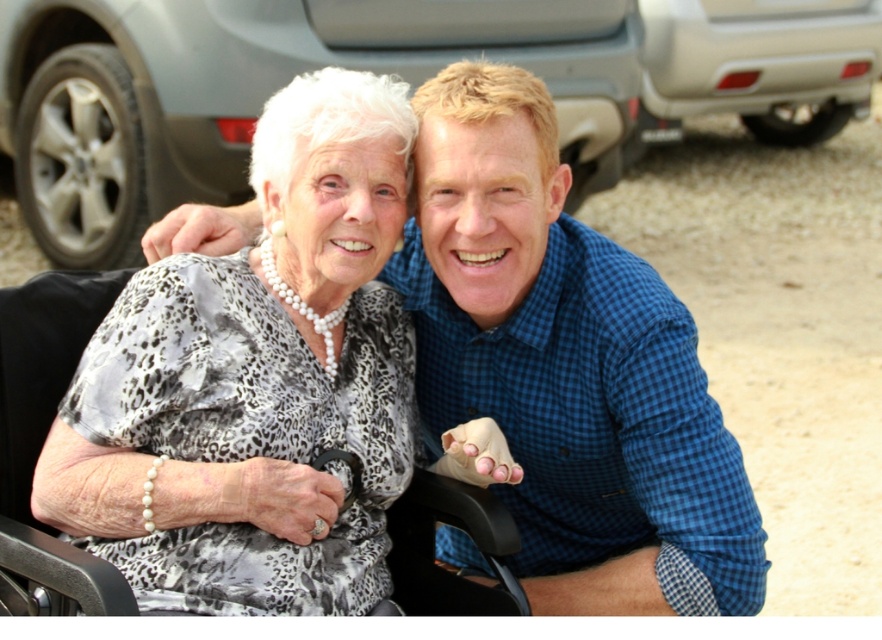
You are a pedestrian trying to cross the road between the metallic gray car at upper center and the silver metallic car at upper right. Is there enough space to walk through?

The metallic gray car at upper center is to the left of the silver metallic car at upper right, so there is space between them for you to walk through.

You are a photographer trying to capture both the white pearl necklace at upper left and the silver metallic car at upper right in the same frame. Given their sizes, which object will appear smaller in the photo?

The white pearl necklace at upper left will appear smaller in the photo because it occupies less space than the silver metallic car at upper right.

You are a delivery person who needs to place a package at the location marked by point [161,508]. However, there is an obstacle at point [561,166]. Can you safely deliver the package without moving the obstacle?

Point [561,166] is behind point [161,508], so the obstacle at point [561,166] is not blocking the delivery path to point [161,508]. You can safely deliver the package without moving the obstacle.